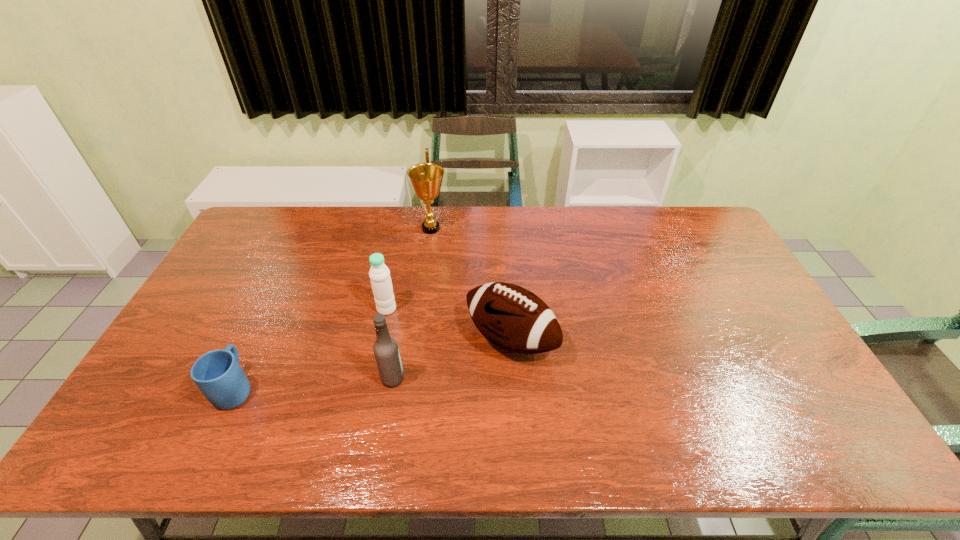
Find the location of a particular element. Image resolution: width=960 pixels, height=540 pixels. free spot between the football (American) and the shortest object is located at coordinates (373, 364).

You are a GUI agent. You are given a task and a screenshot of the screen. Output one action in this format:
    pyautogui.click(x=<x>, y=<y>)
    Task: Click on the free space between the beer bottle and the award
    This screenshot has height=540, width=960.
    Given the screenshot: What is the action you would take?
    pyautogui.click(x=412, y=303)

Image resolution: width=960 pixels, height=540 pixels. Identify the location of free point between the tallest object and the beer bottle. (412, 303).

The height and width of the screenshot is (540, 960). I want to click on empty space that is in between the mug and the water bottle, so click(311, 349).

The height and width of the screenshot is (540, 960). In order to click on free space between the beer bottle and the tallest object in this screenshot , I will do `click(412, 303)`.

The image size is (960, 540). Find the location of `vacant space that is in between the football (American) and the water bottle`. vacant space that is in between the football (American) and the water bottle is located at coordinates pos(448,324).

At what (x,y) coordinates should I click in order to perform the action: click on vacant space in between the rightmost object and the leftmost object. Please return your answer as a coordinate pair (x, y). The width and height of the screenshot is (960, 540). Looking at the image, I should click on (373, 364).

The height and width of the screenshot is (540, 960). Identify the location of vacant space that is in between the leftmost object and the rightmost object. (373, 364).

The width and height of the screenshot is (960, 540). Identify the location of unoccupied area between the shortest object and the water bottle. (311, 349).

Identify the location of object that can be found as the closest to the award. (379, 273).